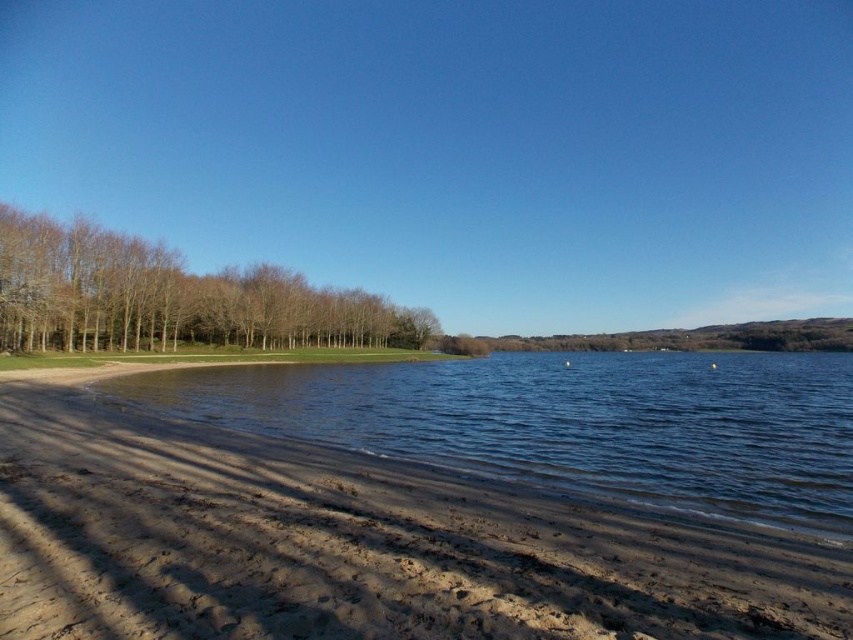
Question: Is dark brown sand at lower left above brown leafless trees at left?

Choices:
 (A) yes
 (B) no

Answer: (B)

Question: Is dark brown sand at lower left in front of brown leafless trees at left?

Choices:
 (A) no
 (B) yes

Answer: (B)

Question: Is the position of dark brown sand at lower left more distant than that of brown leafless trees at left?

Choices:
 (A) yes
 (B) no

Answer: (B)